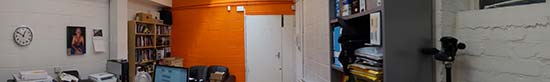
This screenshot has width=550, height=82. I want to click on books, so click(141, 44).